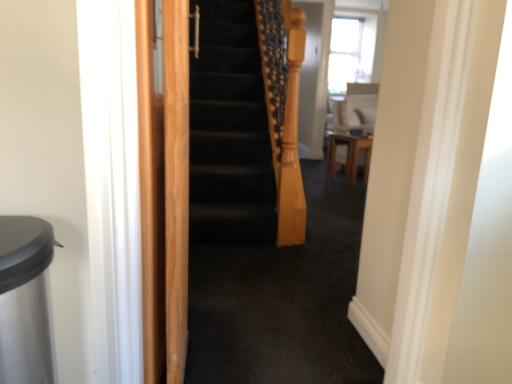
Question: Is light brown wood screen door at left spatially inside wooden table at center, or outside of it?

Choices:
 (A) inside
 (B) outside

Answer: (B)

Question: Considering the positions of light brown wood screen door at left and wooden table at center in the image, is light brown wood screen door at left wider or thinner than wooden table at center?

Choices:
 (A) thin
 (B) wide

Answer: (A)

Question: Which is farther from the light brown wood screen door at left?

Choices:
 (A) white glossy chair at upper right
 (B) wooden table at center

Answer: (A)

Question: Which object is positioned closest to the light brown wood screen door at left?

Choices:
 (A) white glossy chair at upper right
 (B) wooden table at center

Answer: (B)